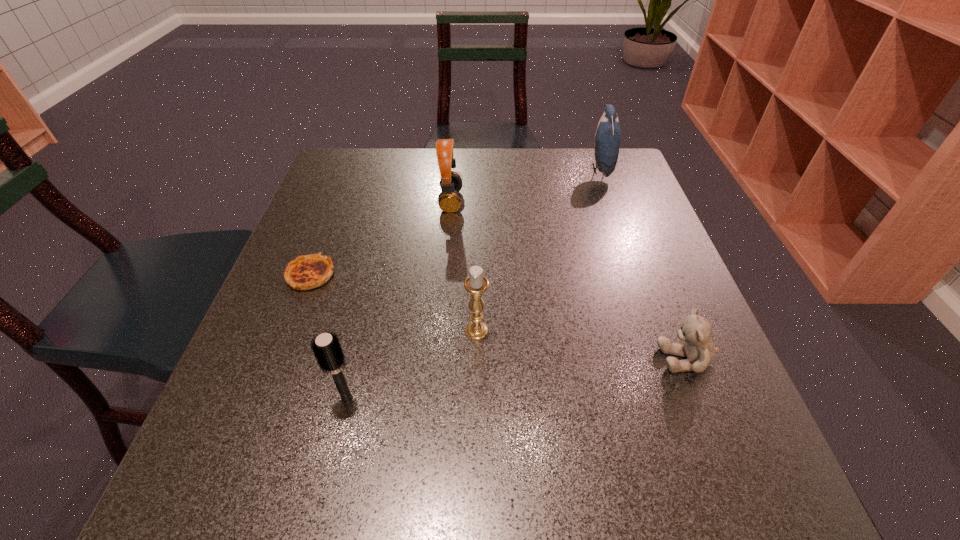
Where is `object that is the second closest to the fifth nearest object`? The image size is (960, 540). object that is the second closest to the fifth nearest object is located at coordinates (476, 284).

This screenshot has width=960, height=540. Find the location of `free space that satisfies the following two spatial constraints: 1. at the tip of the farthest object's beak; 2. on the front side of the candle holder`. free space that satisfies the following two spatial constraints: 1. at the tip of the farthest object's beak; 2. on the front side of the candle holder is located at coordinates (658, 330).